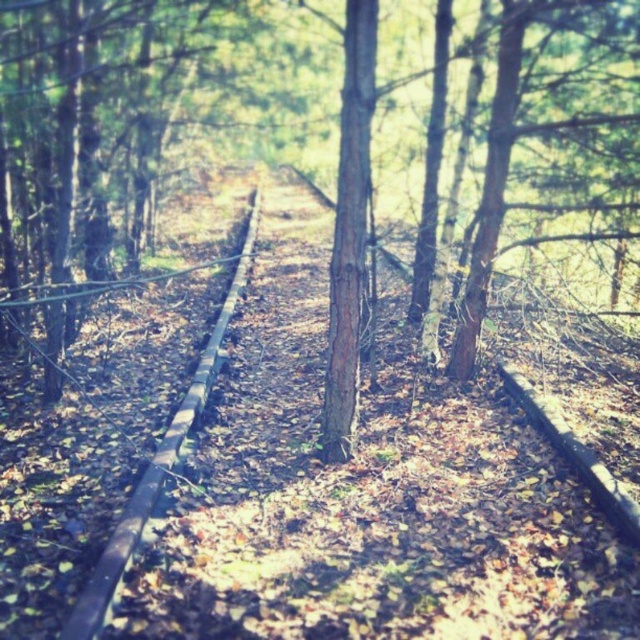
Question: In this image, where is brown rough bark tree at center located relative to brown wooden train track at center?

Choices:
 (A) right
 (B) left

Answer: (A)

Question: Is brown rough bark tree at center below brown wooden train track at center?

Choices:
 (A) no
 (B) yes

Answer: (A)

Question: Is brown rough bark tree at center positioned at the back of brown wooden train track at center?

Choices:
 (A) no
 (B) yes

Answer: (B)